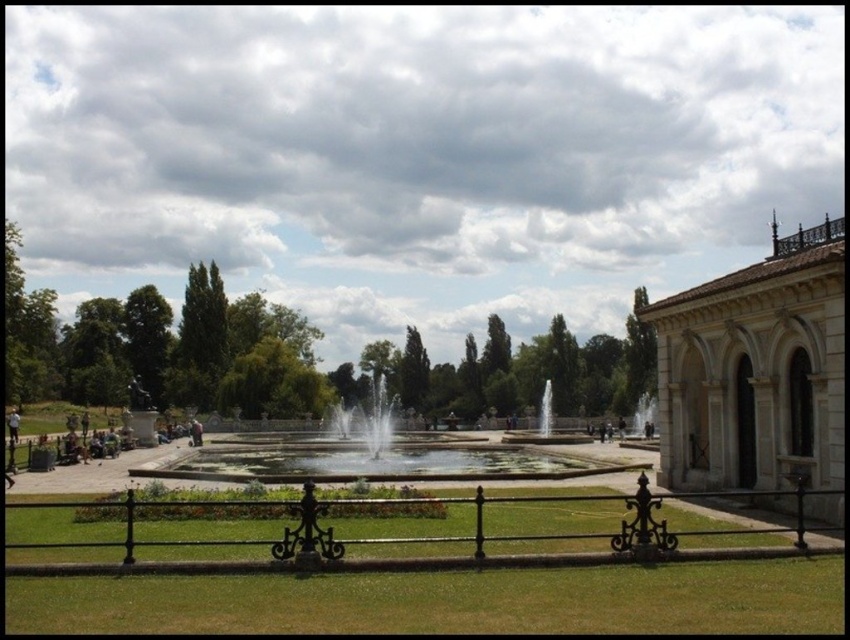
Who is shorter, white stone building at right or clear water fountain at center?

Standing shorter between the two is clear water fountain at center.

Find the location of a particular element. white stone building at right is located at coordinates (755, 371).

Looking at this image, who is more forward, (x=667, y=333) or (x=782, y=531)?

Positioned in front is point (x=782, y=531).

Which is behind, point (765, 340) or point (238, 561)?

The point (765, 340) is behind.

Identify the location of white stone building at right. tap(755, 371).

Can you confirm if black wrought iron fence at center is bigger than clear water fountain at center?

Actually, black wrought iron fence at center might be smaller than clear water fountain at center.

Is black wrought iron fence at center smaller than clear water fountain at center?

Yes, black wrought iron fence at center is smaller than clear water fountain at center.

At what (x,y) coordinates should I click in order to perform the action: click on black wrought iron fence at center. Please return your answer as a coordinate pair (x, y). This screenshot has height=640, width=850. Looking at the image, I should click on (438, 540).